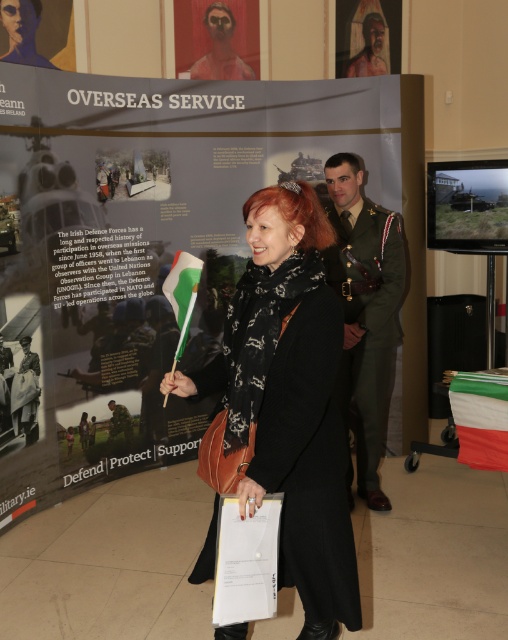
Can you confirm if matte black poster at center is positioned to the right of white fabric flag at center?

Incorrect, matte black poster at center is not on the right side of white fabric flag at center.

Which is more to the right, matte black poster at center or white fabric flag at center?

white fabric flag at center is more to the right.

Identify the location of matte black poster at center. This screenshot has width=508, height=640. (140, 250).

Does green uniform at center lie in front of white fabric flag at center?

No, it is not.

Measure the distance between green uniform at center and white fabric flag at center.

A distance of 1.40 meters exists between green uniform at center and white fabric flag at center.

The width and height of the screenshot is (508, 640). Describe the element at coordinates (365, 310) in the screenshot. I see `green uniform at center` at that location.

Locate an element on the screen. green uniform at center is located at coordinates (365, 310).

Which of these two, white fabric flag at lower right or reddish-brown textured face at upper center, stands shorter?

With less height is white fabric flag at lower right.

Based on the photo, who is more distant from viewer, (504, 465) or (374, 54)?

The point (374, 54) is more distant.

The image size is (508, 640). Find the location of `white fabric flag at lower right`. white fabric flag at lower right is located at coordinates (481, 419).